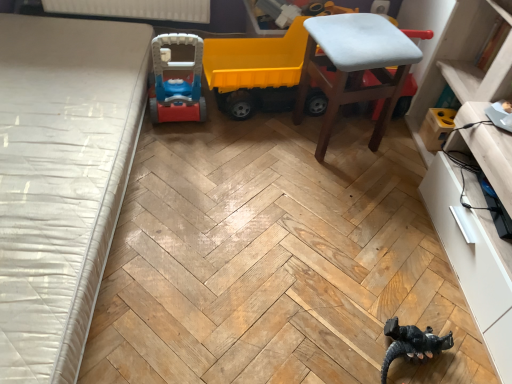
Identify the location of vacant region below light blue fabric stool at upper right (from a real-world perspective). The height and width of the screenshot is (384, 512). (336, 134).